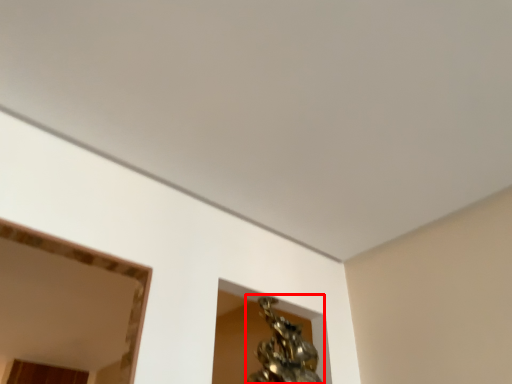
Question: From the image's perspective, considering the relative positions of bronze sculpture (annotated by the red box) and mirror in the image provided, where is bronze sculpture (annotated by the red box) located with respect to the staircase?

Choices:
 (A) below
 (B) above

Answer: (B)